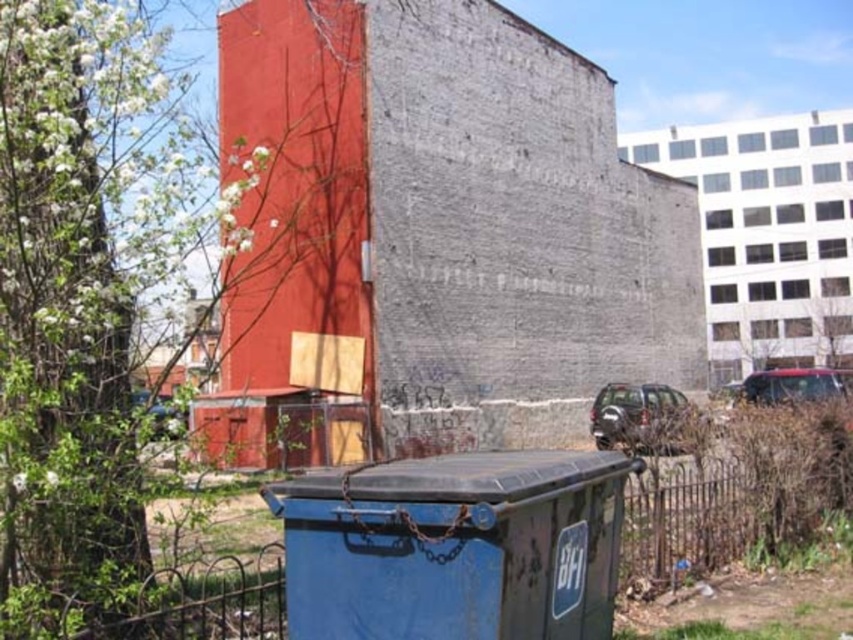
You are standing at the point labeled point (373,618) and want to walk to the red building. The path is clear except for a blue dumpster 3.64 meters away. Can you walk around it without crossing the fence?

The distance between you and the blue dumpster is 3.64 meters. Since the path is clear except for the dumpster and the fence is nearby, you can walk around the dumpster while staying clear of the fence.

Looking at this image, you are standing at the point with coordinates point (831, 323). Looking around, you see a green leafy tree at upper right. Can you determine if you are standing on the tree?

The point (831, 323) is on green leafy tree at upper right, so yes, you are standing on the green leafy tree at upper right.